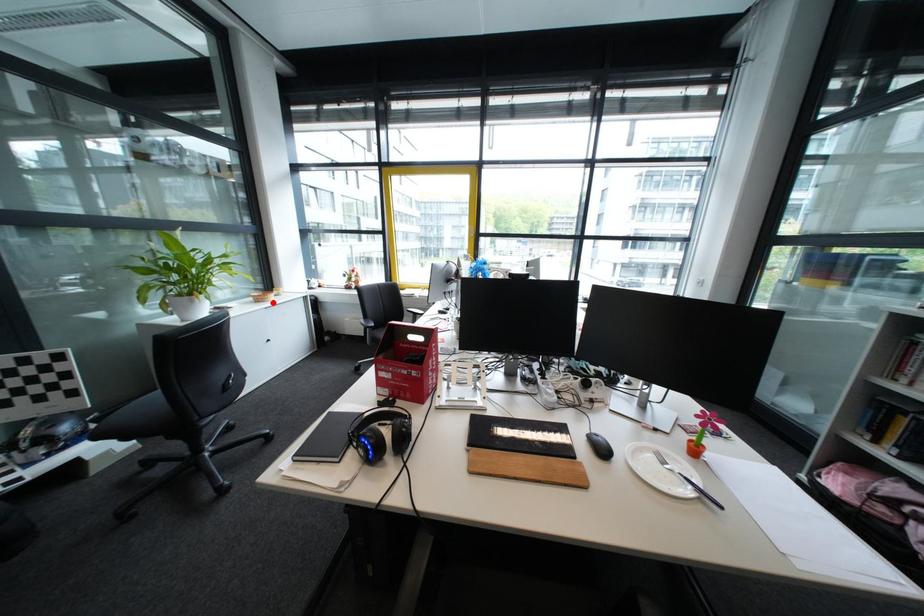
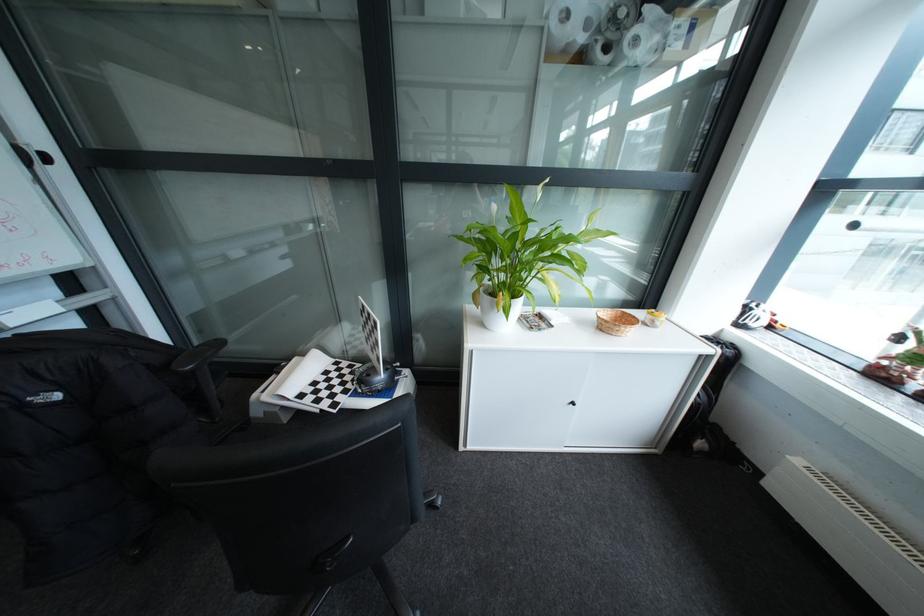
Where in the second image is the point corresponding to the highlighted location from the first image?

(614, 331)